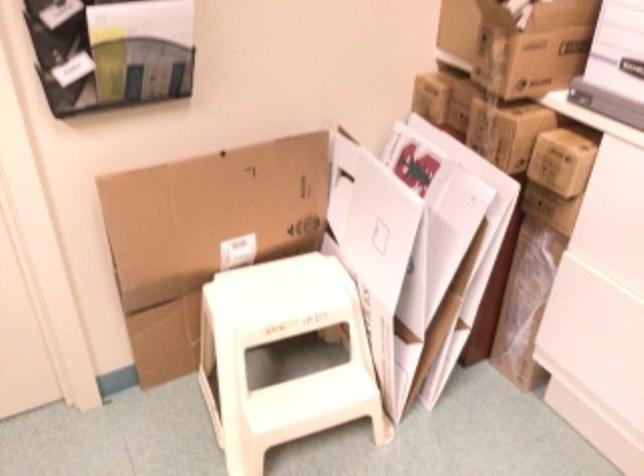
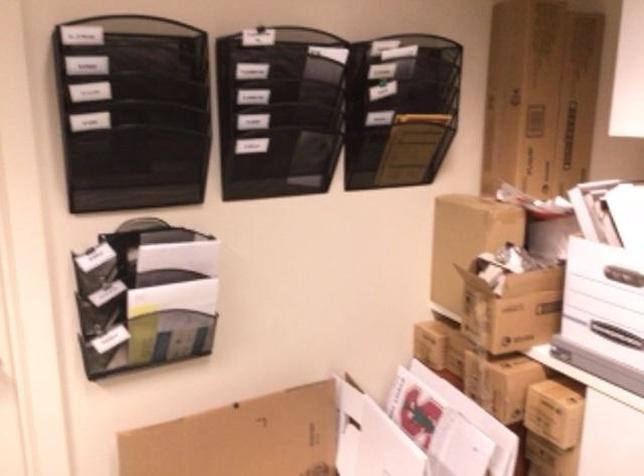
Question: Based on the continuous images, in which direction is the camera rotating? Reply with the corresponding letter.

Choices:
 (A) Left
 (B) Right
 (C) Up
 (D) Down

Answer: (C)